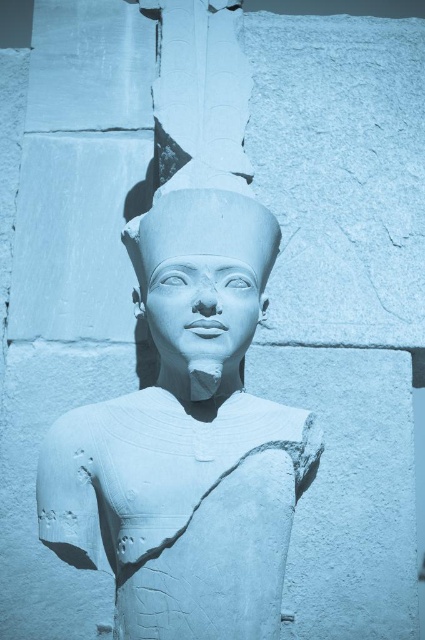
Question: Can you confirm if white stone statue at center is positioned to the left of white stone head at center?

Choices:
 (A) yes
 (B) no

Answer: (B)

Question: Which point appears closest to the camera in this image?

Choices:
 (A) (155, 513)
 (B) (176, 253)

Answer: (A)

Question: Is white stone statue at center smaller than white stone head at center?

Choices:
 (A) no
 (B) yes

Answer: (A)

Question: Can you confirm if white stone statue at center is positioned above white stone head at center?

Choices:
 (A) yes
 (B) no

Answer: (B)

Question: Which point is farther from the camera taking this photo?

Choices:
 (A) (153, 545)
 (B) (204, 225)

Answer: (B)